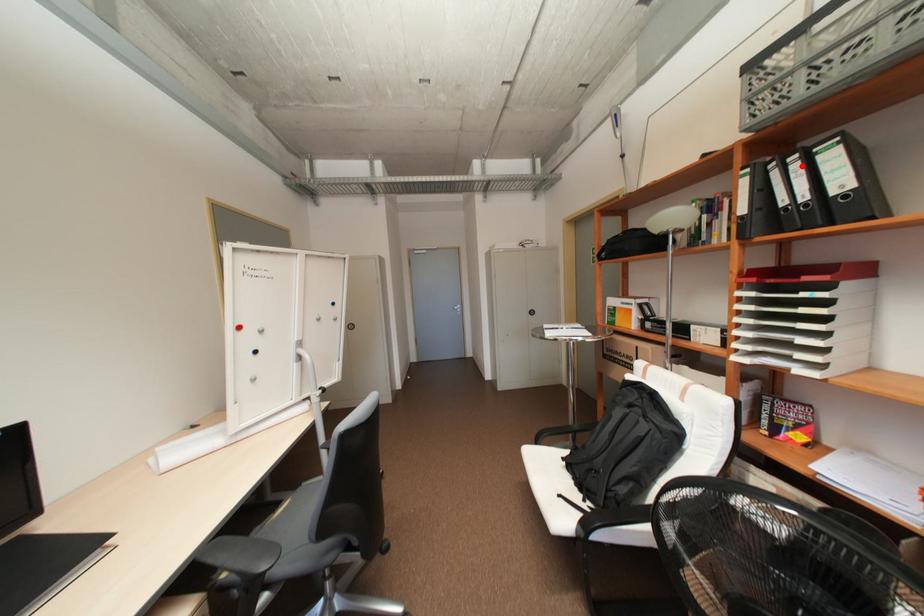
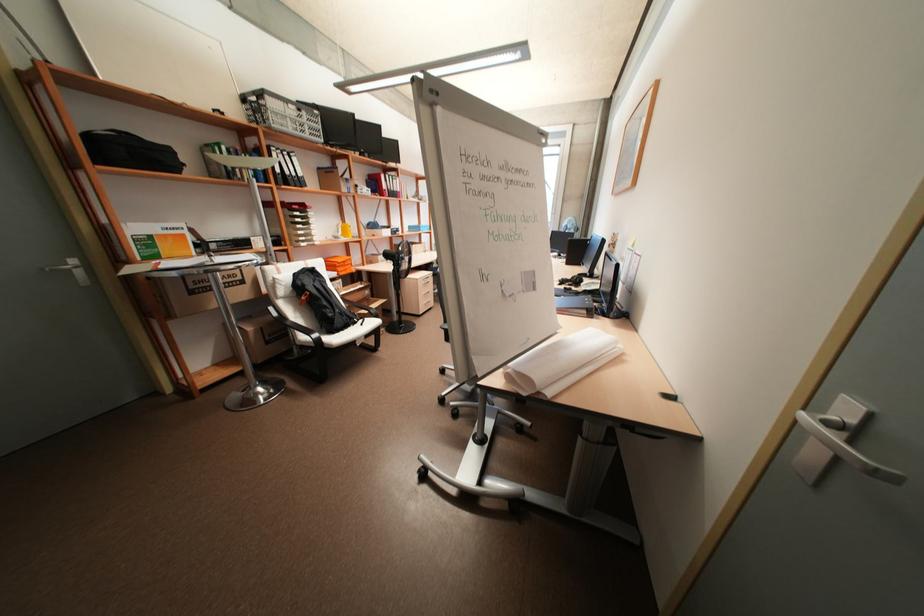
Question: I am providing you with two images of the same scene from different viewpoints. In image1, a red point is highlighted. Considering the same 3D point in image2, which of the following is correct?

Choices:
 (A) It is closer
 (B) It is farther

Answer: (A)